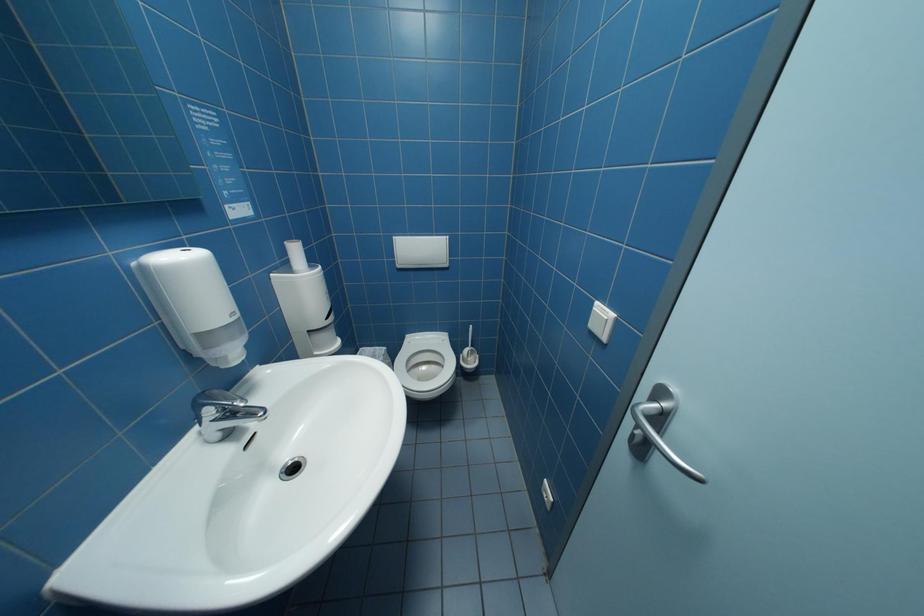
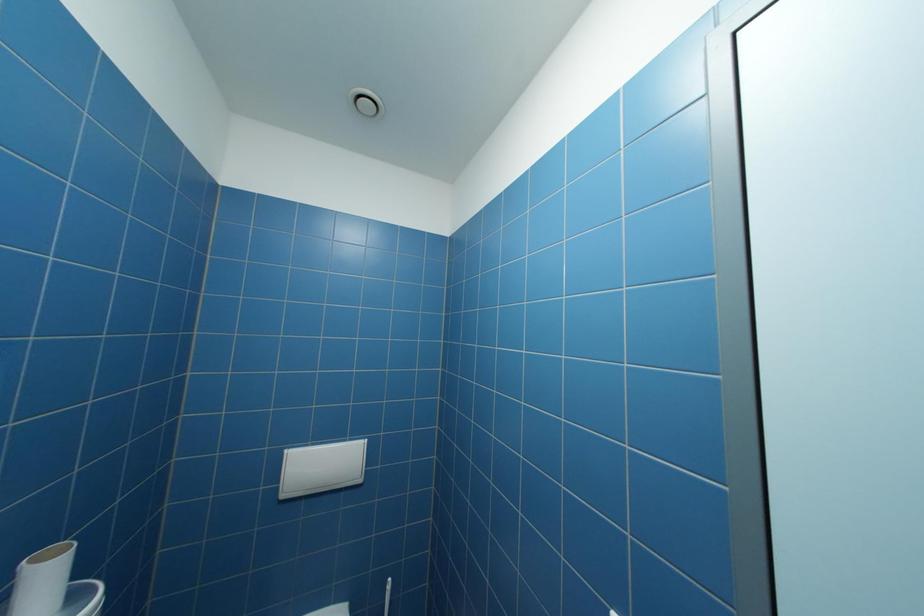
The images are taken continuously from a first-person perspective. In which direction is your viewpoint rotating?

The camera's rotation is toward right-up.